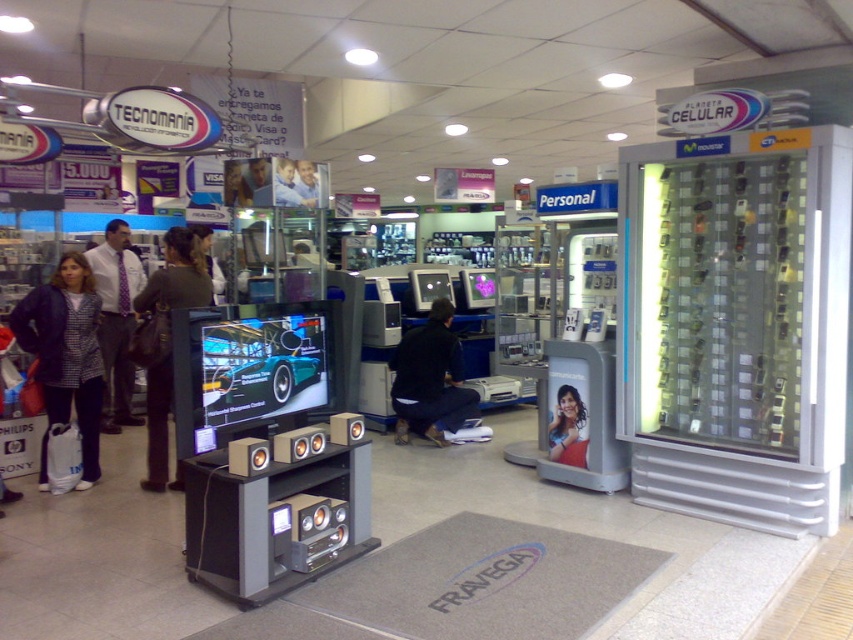
You are a customer in the electronics store and see the display setup with the TV showing a racing game. There is a point marked at coordinates (65,356). What object is located at that point?

The point at coordinates (65,356) corresponds to the denim jacket at lower left.

You are a delivery person who needs to place a large package on the floor between the shiny metallic car at center and the plaid fabric jacket at left. Can you fit the package if it measures 1.2 meters in width?

The shiny metallic car at center might be wider than plaid fabric jacket at left, but without exact measurements, it is uncertain if the space between them is sufficient for a 1.2 meter wide package. Check the actual distance before placing the package.

You are standing in the electronics store and want to take a close look at the display setup. Which of the two points, point (61, 404) or point (190, 225), is closer to you?

Point (61, 404) is closer to the camera than point (190, 225), so it is closer to you.